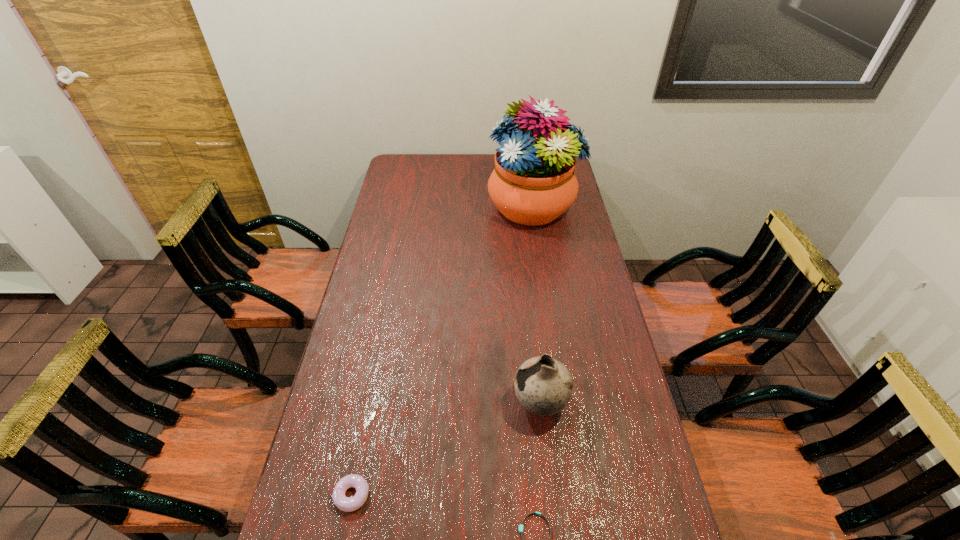
Find the location of a particular element. This screenshot has height=540, width=960. object that ranks as the second closest to the third nearest object is located at coordinates (347, 504).

Select which object is the closest to the shortest object. Please provide its 2D coordinates. Your answer should be formatted as a tuple, i.e. [(x, y)], where the tuple contains the x and y coordinates of a point satisfying the conditions above.

[(543, 385)]

Identify the location of vacant region that satisfies the following two spatial constraints: 1. from the spout of the third shortest object; 2. on the front side of the third tallest object. The width and height of the screenshot is (960, 540). (550, 495).

This screenshot has width=960, height=540. Find the location of `vacant point that satisfies the following two spatial constraints: 1. from the spout of the third nearest object; 2. on the front side of the second shortest object`. vacant point that satisfies the following two spatial constraints: 1. from the spout of the third nearest object; 2. on the front side of the second shortest object is located at coordinates tap(550, 495).